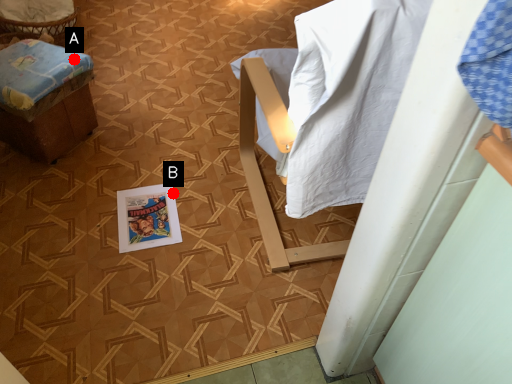
Question: Two points are circled on the image, labeled by A and B beside each circle. Which point is closer to the camera?

Choices:
 (A) A is closer
 (B) B is closer

Answer: (A)